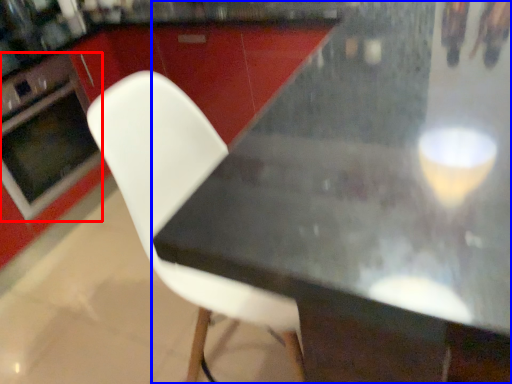
Question: Which point is closer to the camera, oven (highlighted by a red box) or table (highlighted by a blue box)?

Choices:
 (A) oven
 (B) table

Answer: (B)